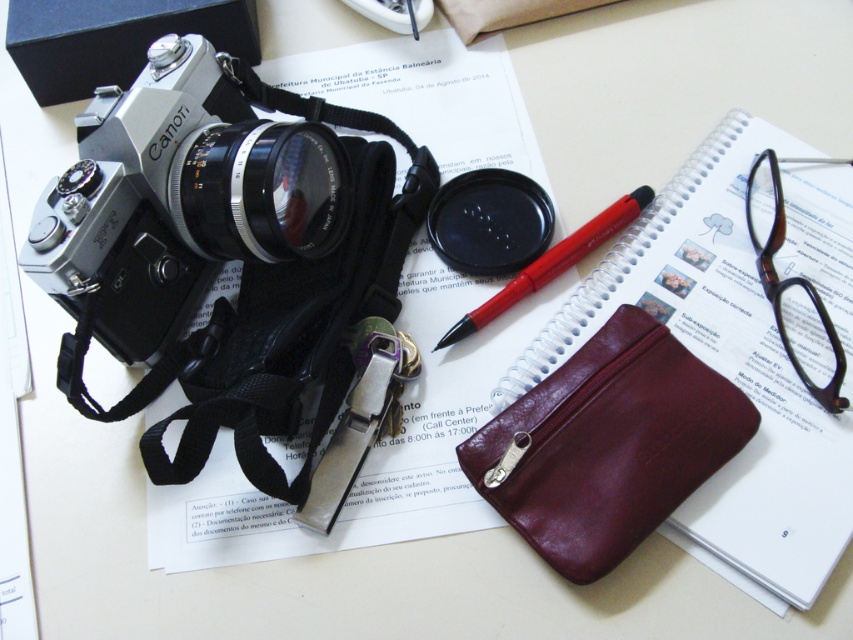
In the scene shown: Does burgundy leather pouch at center have a greater height compared to black matte lens cap at center?

Correct, burgundy leather pouch at center is much taller as black matte lens cap at center.

Is point (675, 452) farther from viewer compared to point (527, 192)?

No, it is not.

Image resolution: width=853 pixels, height=640 pixels. I want to click on burgundy leather pouch at center, so click(x=607, y=444).

Is point (335, 150) positioned after point (488, 240)?

No, (335, 150) is closer to viewer.

Which is below, silver metallic camera at upper left or black matte lens cap at center?

Positioned lower is black matte lens cap at center.

Image resolution: width=853 pixels, height=640 pixels. Find the location of `silver metallic camera at upper left`. silver metallic camera at upper left is located at coordinates (187, 193).

Is spiral-bound paper at center closer to camera compared to red plastic pen at center?

Yes, spiral-bound paper at center is closer to the viewer.

Can you confirm if spiral-bound paper at center is shorter than red plastic pen at center?

Incorrect, spiral-bound paper at center's height does not fall short of red plastic pen at center's.

Does point (676, 212) come farther from viewer compared to point (618, 198)?

No, (676, 212) is closer to viewer.

Where is `spiral-bound paper at center`? spiral-bound paper at center is located at coordinates [723, 365].